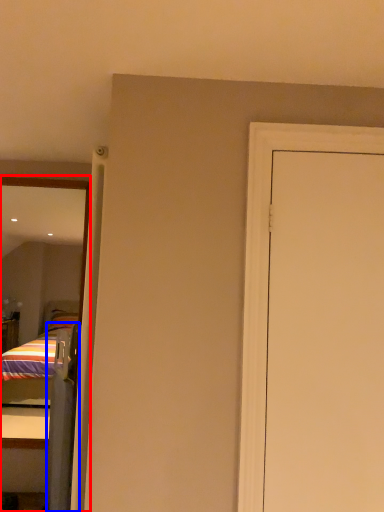
Question: Which point is further to the camera, mirror (highlighted by a red box) or screen door (highlighted by a blue box)?

Choices:
 (A) mirror
 (B) screen door

Answer: (A)